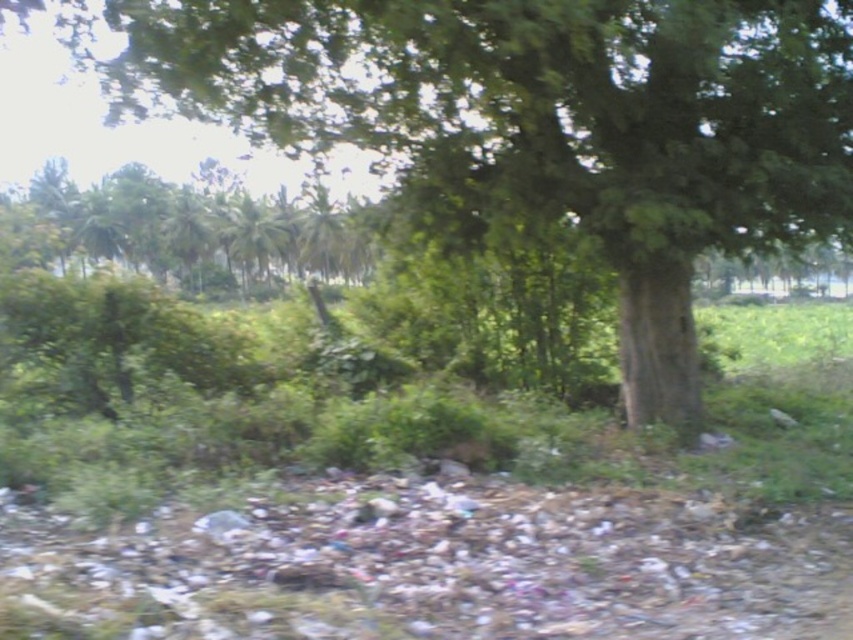
Consider the image. You are a hiker standing in the middle of the forest. You see the green rough bark tree at center and the green leafy tree at upper left. Which tree is positioned more to the east?

The green rough bark tree at center is to the right of green leafy tree at upper left, so the green rough bark tree at center is positioned more to the east.

You are standing in a natural outdoor scene with a large tree in front of you. You notice a point marked at coordinates (523, 28). Can you estimate how far this point is from your current position?

The point at coordinates (523, 28) is 7.41 meters away from the viewer.

You are a bird looking for a nesting spot. You see the green rough bark tree at center and the green leafy tree at upper left. Which tree is taller and would provide a better vantage point?

The green rough bark tree at center is taller than the green leafy tree at upper left, so it would provide a better vantage point for nesting.